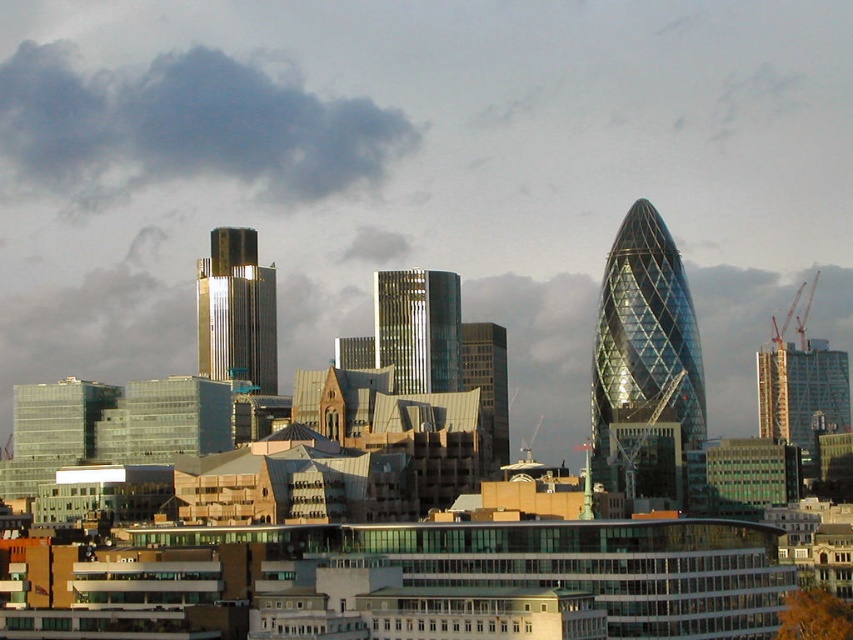
Question: Which object is closer to the camera taking this photo?

Choices:
 (A) gold reflective glass skyscraper at center
 (B) shiny metallic skyscraper at center

Answer: (B)

Question: Among these points, which one is nearest to the camera?

Choices:
 (A) (505, 365)
 (B) (154, 168)
 (C) (639, 403)

Answer: (A)

Question: Is gold reflective glass skyscraper at center to the left of glassy reflective skyscraper at center from the viewer's perspective?

Choices:
 (A) yes
 (B) no

Answer: (A)

Question: Observing the image, what is the correct spatial positioning of gold reflective glass skyscraper at center in reference to shiny metallic skyscraper at center?

Choices:
 (A) right
 (B) left

Answer: (B)

Question: Considering the real-world distances, which object is closest to the gold reflective glass skyscraper at center?

Choices:
 (A) dark gray cloud at upper left
 (B) transparent glass tower at center right
 (C) glassy reflective skyscraper at center
 (D) shiny metallic skyscraper at center

Answer: (D)

Question: Considering the relative positions of transparent glass tower at center right and gold reflective glass skyscraper at center in the image provided, where is transparent glass tower at center right located with respect to gold reflective glass skyscraper at center?

Choices:
 (A) right
 (B) left

Answer: (A)